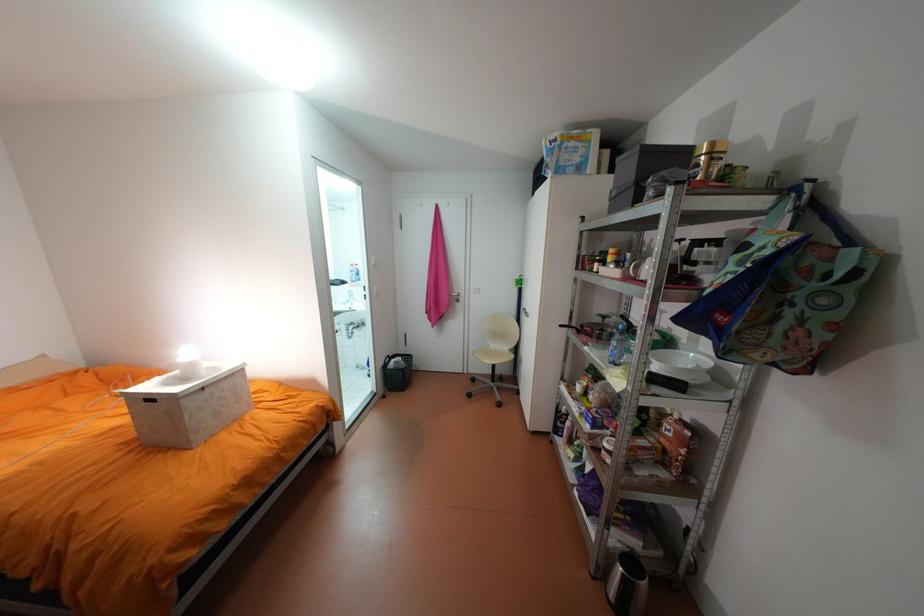
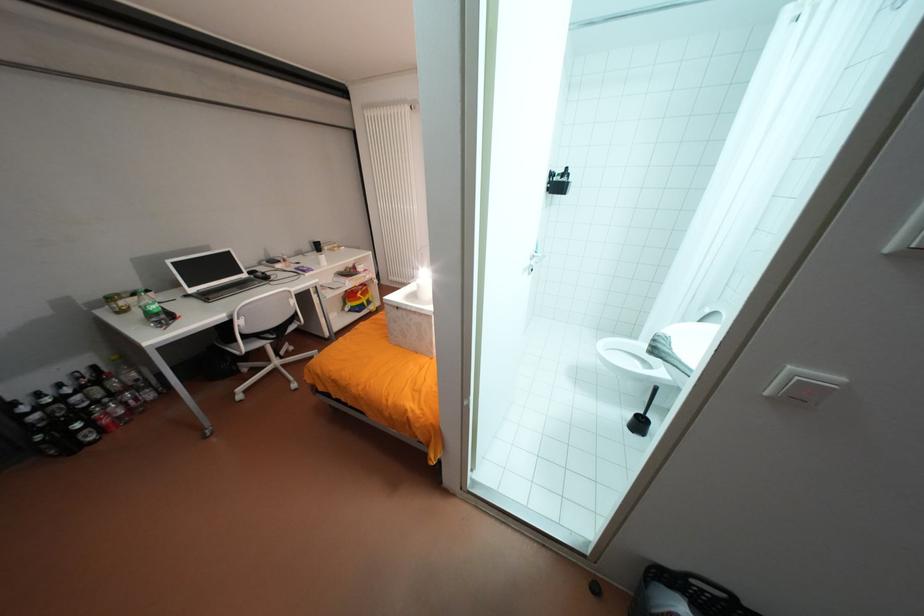
Locate, in the second image, the point that corresponds to pixel 402 360 in the first image.

(694, 609)